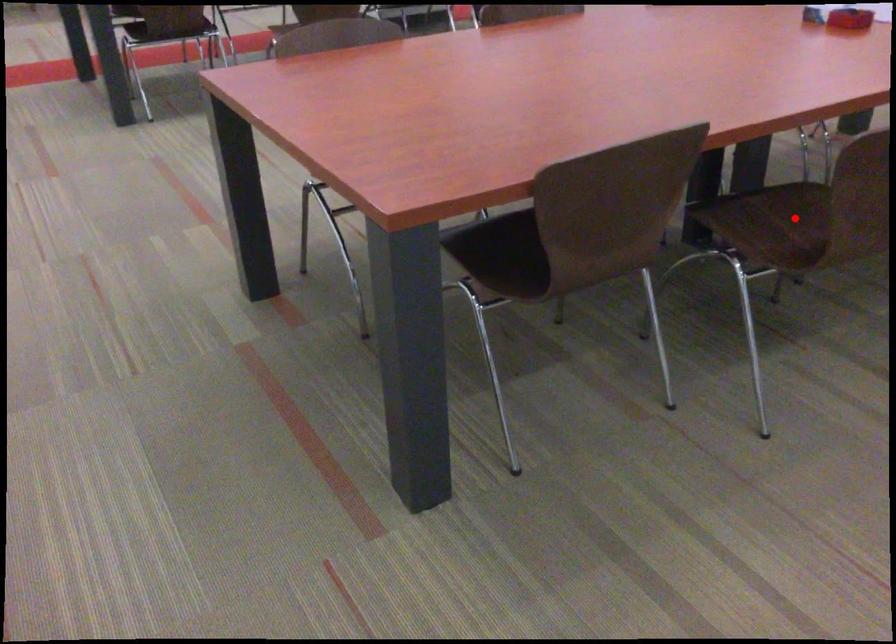
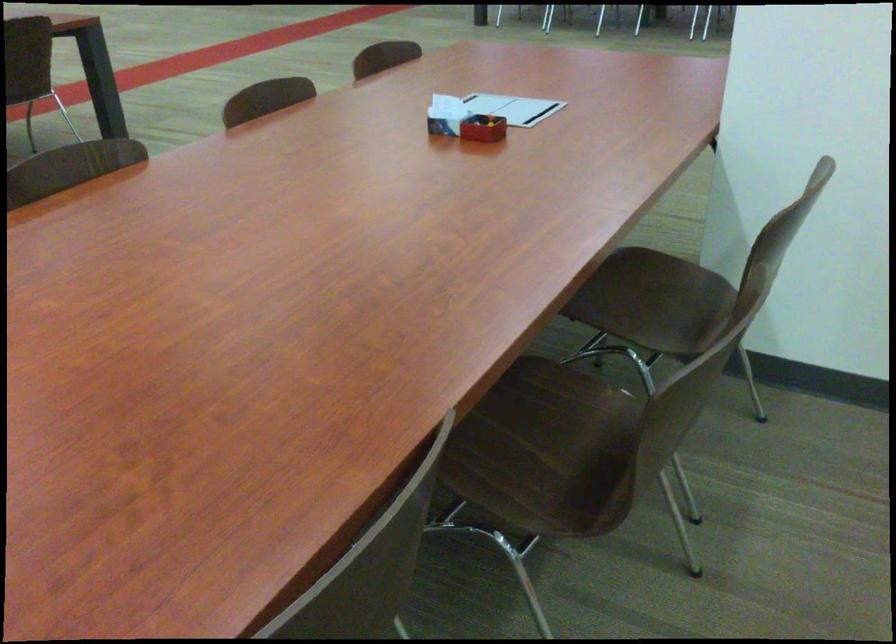
Question: I am providing you with two images of the same scene from different viewpoints. In image1, a red point is highlighted. Considering the same 3D point in image2, which of the following is correct?

Choices:
 (A) It is closer
 (B) It is farther

Answer: (A)